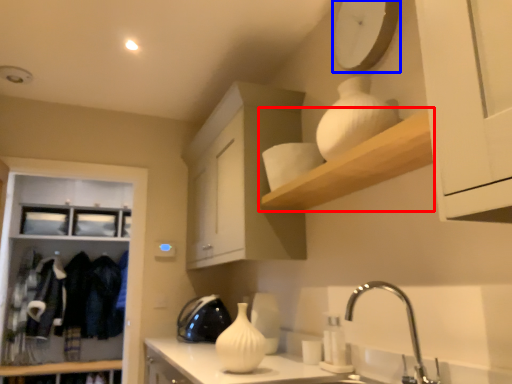
Question: Which of the following is the farthest to the observer, shelf (highlighted by a red box) or clock (highlighted by a blue box)?

Choices:
 (A) shelf
 (B) clock

Answer: (B)